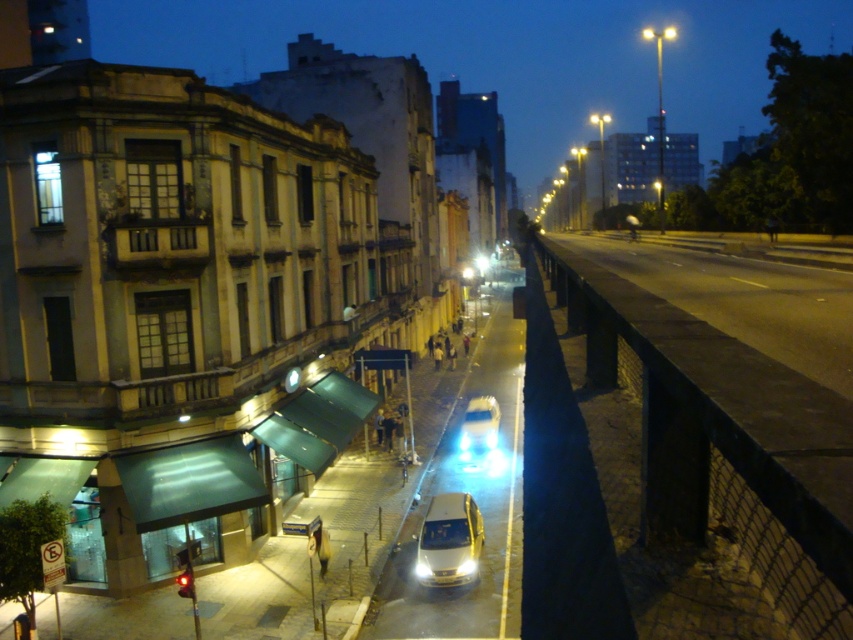
Question: Among these points, which one is nearest to the camera?

Choices:
 (A) (465, 451)
 (B) (457, 563)

Answer: (B)

Question: Does yellow matte car at center appear on the left side of shiny silver car at center?

Choices:
 (A) yes
 (B) no

Answer: (A)

Question: Which point is farther to the camera?

Choices:
 (A) (476, 412)
 (B) (434, 499)

Answer: (A)

Question: In this image, where is yellow matte car at center located relative to shiny silver car at center?

Choices:
 (A) left
 (B) right

Answer: (A)

Question: Can you confirm if yellow matte car at center is thinner than shiny silver car at center?

Choices:
 (A) yes
 (B) no

Answer: (A)